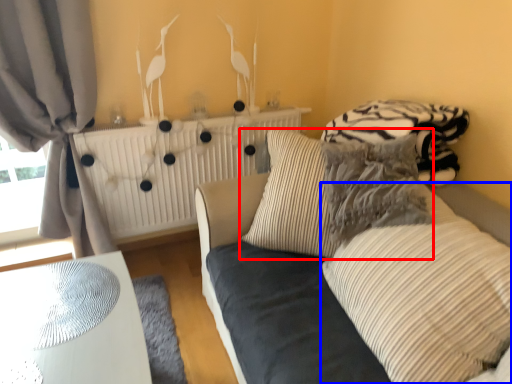
Question: Which of the following is the closest to the observer, pillow (highlighted by a red box) or pillow (highlighted by a blue box)?

Choices:
 (A) pillow
 (B) pillow

Answer: (B)